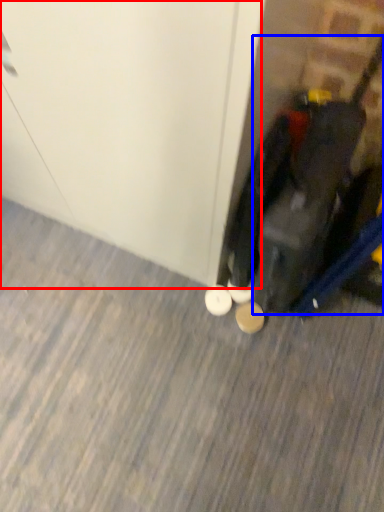
Question: Which of the following is the farthest to the observer, door (highlighted by a red box) or luggage (highlighted by a blue box)?

Choices:
 (A) door
 (B) luggage

Answer: (B)